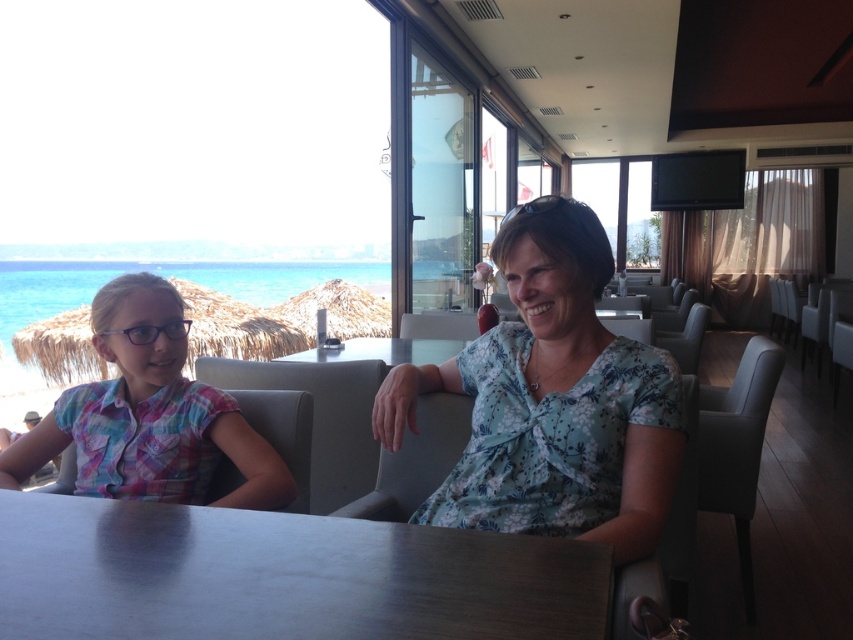
Question: Can you confirm if floral fabric blouse at center is wider than smooth glass table at center?

Choices:
 (A) yes
 (B) no

Answer: (B)

Question: Does floral fabric blouse at center appear over multicolored plaid shirt at left?

Choices:
 (A) yes
 (B) no

Answer: (A)

Question: Which point is farther from the camera taking this photo?

Choices:
 (A) (279, 468)
 (B) (448, 342)

Answer: (B)

Question: Which point appears closest to the camera in this image?

Choices:
 (A) (379, 340)
 (B) (126, 486)
 (C) (514, 205)
 (D) (157, 608)

Answer: (D)

Question: Which of the following is the closest to the observer?

Choices:
 (A) smooth wooden table at center
 (B) black plastic goggles at upper center
 (C) multicolored plaid shirt at left
 (D) smooth glass table at center

Answer: (A)

Question: Does floral fabric blouse at center have a greater width compared to multicolored plaid shirt at left?

Choices:
 (A) yes
 (B) no

Answer: (B)